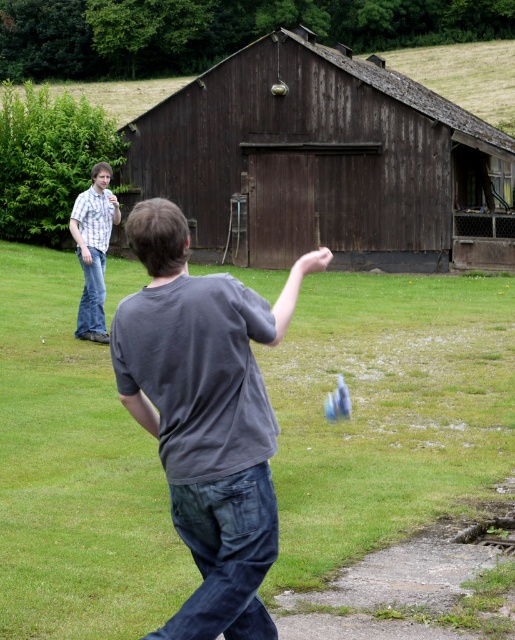
You are standing in the outdoor scene and want to walk from point A to point B. The coordinates for point A are point (495, 227) and point B are point (190, 308). Which direction should you move to get closer to point B?

To move from point A to point B, you should move downward and to the right because point B is located at a lower vertical position and to the right horizontally compared to point A.